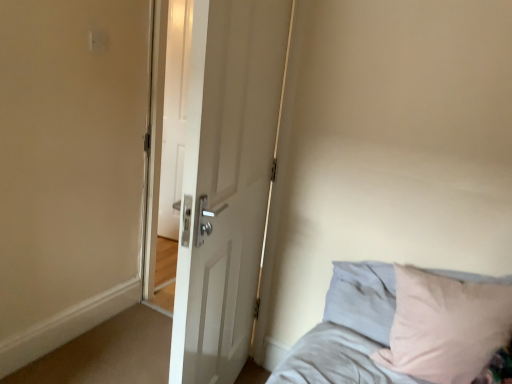
Question: Is white matte door at center far away from light gray fabric bed at lower right?

Choices:
 (A) yes
 (B) no

Answer: (B)

Question: Is white matte door at center looking in the opposite direction of light gray fabric bed at lower right?

Choices:
 (A) yes
 (B) no

Answer: (A)

Question: Can you confirm if white matte door at center is thinner than light gray fabric bed at lower right?

Choices:
 (A) no
 (B) yes

Answer: (B)

Question: Does white matte door at center turn towards light gray fabric bed at lower right?

Choices:
 (A) yes
 (B) no

Answer: (A)

Question: Does white matte door at center have a greater height compared to light gray fabric bed at lower right?

Choices:
 (A) yes
 (B) no

Answer: (A)

Question: Is light gray fabric bed at lower right inside white matte door at center?

Choices:
 (A) yes
 (B) no

Answer: (B)

Question: Does light gray fabric bed at lower right have a lesser height compared to white matte door at center?

Choices:
 (A) yes
 (B) no

Answer: (A)

Question: From a real-world perspective, is light gray fabric bed at lower right under white matte door at center?

Choices:
 (A) yes
 (B) no

Answer: (A)

Question: Is light gray fabric bed at lower right thinner than white matte door at center?

Choices:
 (A) no
 (B) yes

Answer: (A)

Question: Is light gray fabric bed at lower right turned away from white matte door at center?

Choices:
 (A) yes
 (B) no

Answer: (A)

Question: From the image's perspective, is light gray fabric bed at lower right on white matte door at center?

Choices:
 (A) no
 (B) yes

Answer: (A)

Question: Can you confirm if light gray fabric bed at lower right is bigger than white matte door at center?

Choices:
 (A) no
 (B) yes

Answer: (A)

Question: From a real-world perspective, relative to light gray fabric bed at lower right, is white matte door at center vertically above or below?

Choices:
 (A) below
 (B) above

Answer: (B)